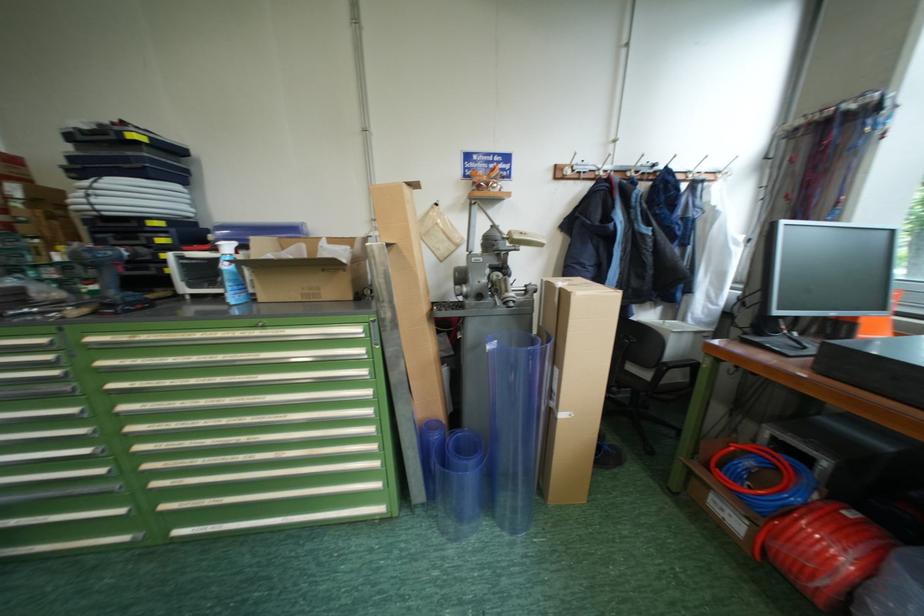
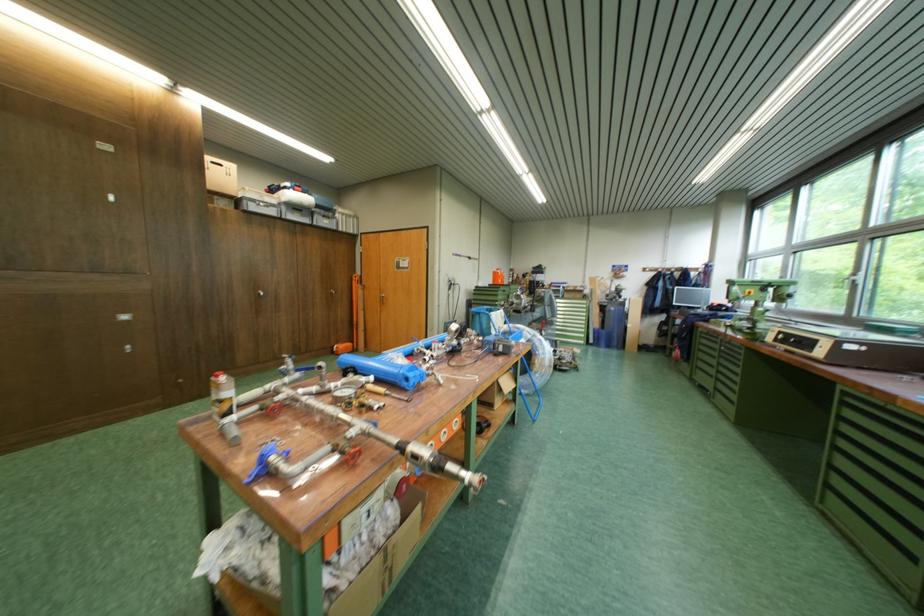
Where in the second image is the point corresponding to [388,488] from the first image?

(592, 338)